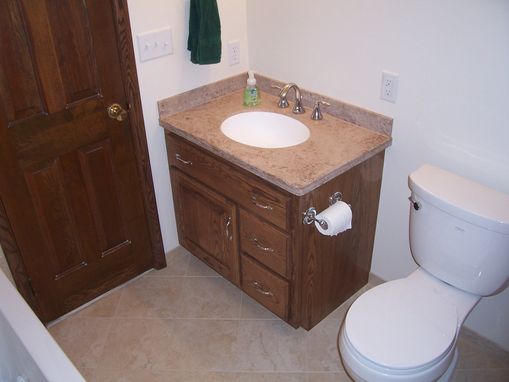
The height and width of the screenshot is (382, 509). In order to click on handsoap in this screenshot , I will do point(250,95).